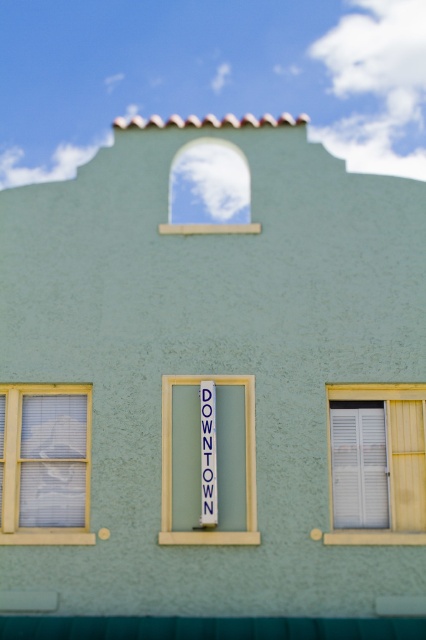
You are an architect designing a new building and want to ensure that the white wooden shutters at right and the white glass window at upper center are proportionate. Based on the image, which object should be made larger to maintain balance?

The white wooden shutters at right should be made larger to match the size of the white glass window at upper center since the shutters currently occupy less space than the window.

Looking at this image, you are standing in front of the building and want to locate the white wooden shutters at right and the white glass window at upper center. Which one is positioned to the right of the other?

The white wooden shutters at right is positioned to the right of the white glass window at upper center.